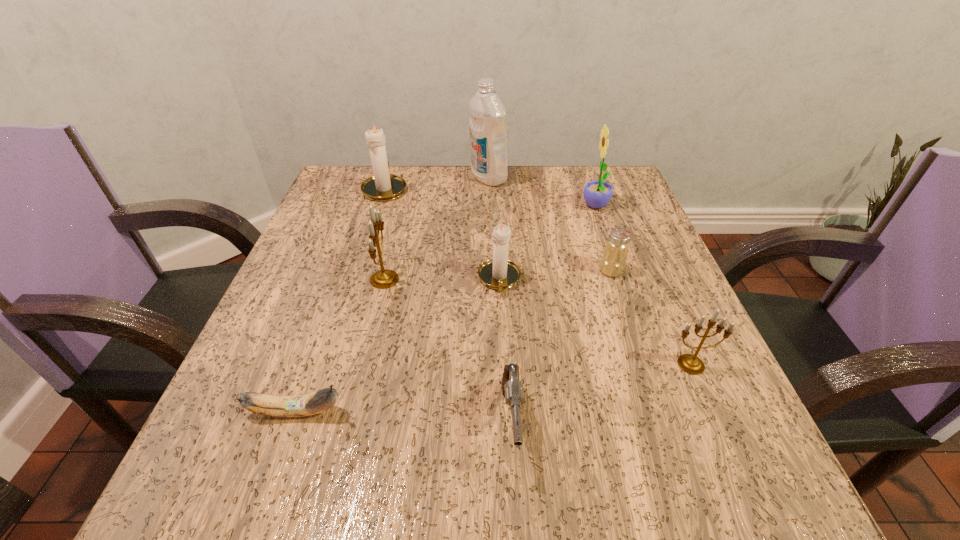
Where is `the nearer gold candelabrum`? The image size is (960, 540). the nearer gold candelabrum is located at coordinates (689, 363).

Where is `saltshaker`? The width and height of the screenshot is (960, 540). saltshaker is located at coordinates (613, 261).

Identify the location of pistol. The width and height of the screenshot is (960, 540). (512, 389).

At what (x,y) coordinates should I click in order to perform the action: click on the shortest object. Please return your answer as a coordinate pair (x, y). The height and width of the screenshot is (540, 960). Looking at the image, I should click on (319, 401).

Find the location of `vacant space located 0.350m on the front of the tallest object`. vacant space located 0.350m on the front of the tallest object is located at coordinates (492, 286).

Where is `free space located 0.370m on the front-facing side of the sunflower`? The height and width of the screenshot is (540, 960). free space located 0.370m on the front-facing side of the sunflower is located at coordinates (423, 207).

The width and height of the screenshot is (960, 540). What are the coordinates of `vacant space located 0.230m on the front-facing side of the sunflower` in the screenshot? It's located at (483, 207).

This screenshot has height=540, width=960. In order to click on blank space located 0.150m on the front-facing side of the sunflower in this screenshot , I will do `click(517, 207)`.

Where is `vacant region located on the front of the left gold candelabrum`? The height and width of the screenshot is (540, 960). vacant region located on the front of the left gold candelabrum is located at coordinates (369, 344).

This screenshot has width=960, height=540. Find the location of `free space located on the handle side of the nearer white candle holder`. free space located on the handle side of the nearer white candle holder is located at coordinates (502, 335).